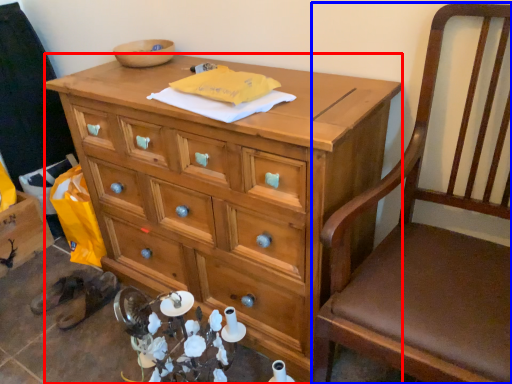
Question: Which point is further to the camera, desk (highlighted by a red box) or chair (highlighted by a blue box)?

Choices:
 (A) desk
 (B) chair

Answer: (A)